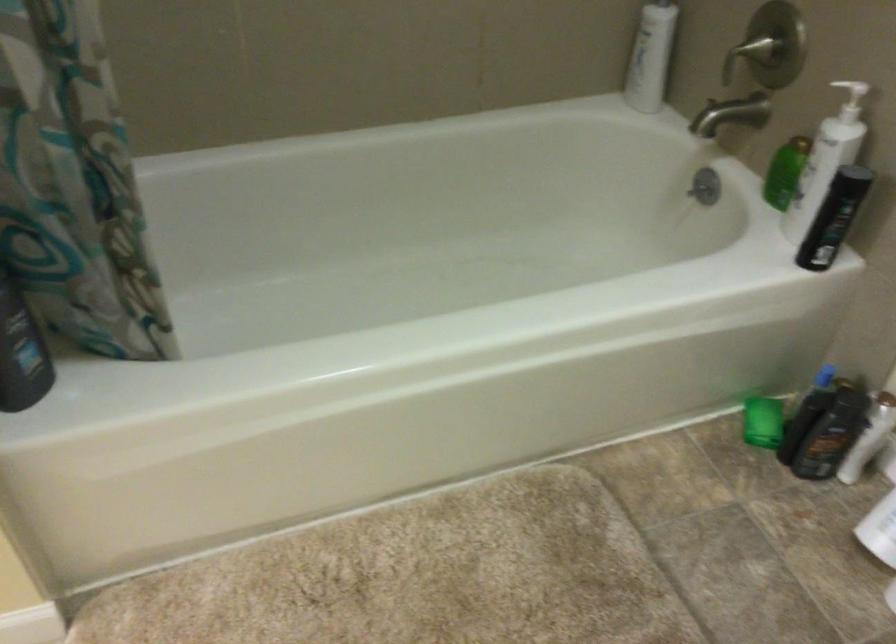
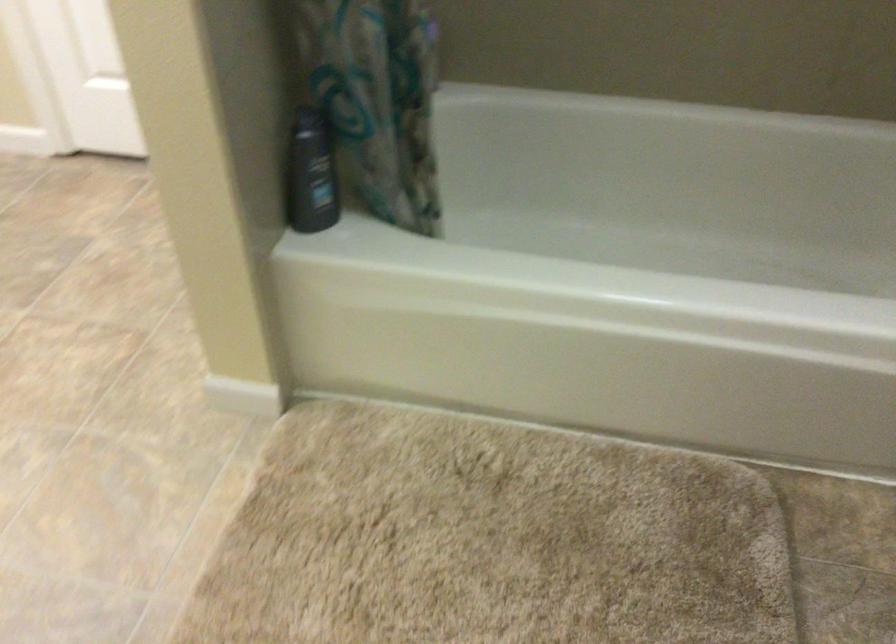
Question: The first image is from the beginning of the video and the second image is from the end. How did the camera likely rotate when shooting the video?

Choices:
 (A) Left
 (B) Right
 (C) Up
 (D) Down

Answer: (A)